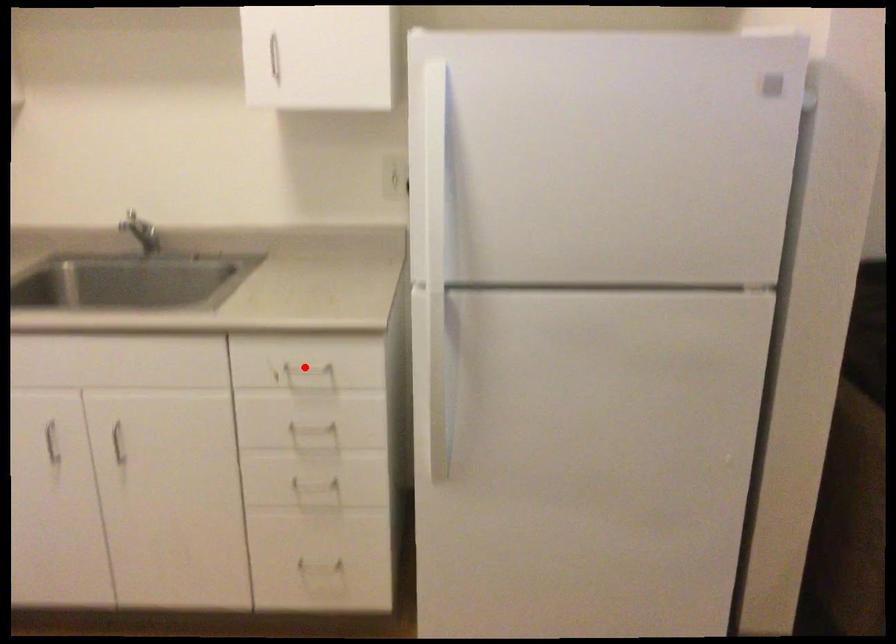
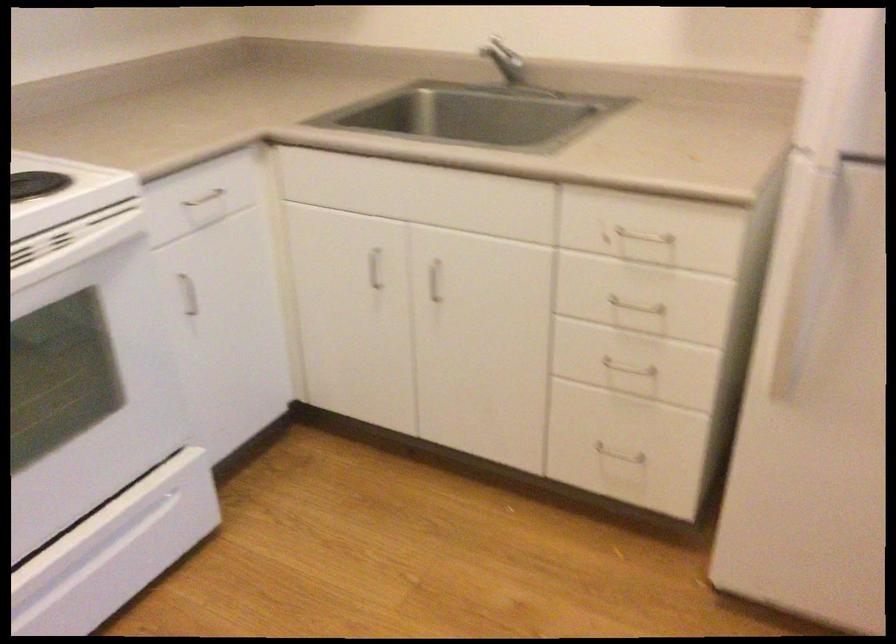
In the second image, find the point that corresponds to the highlighted location in the first image.

(639, 236)